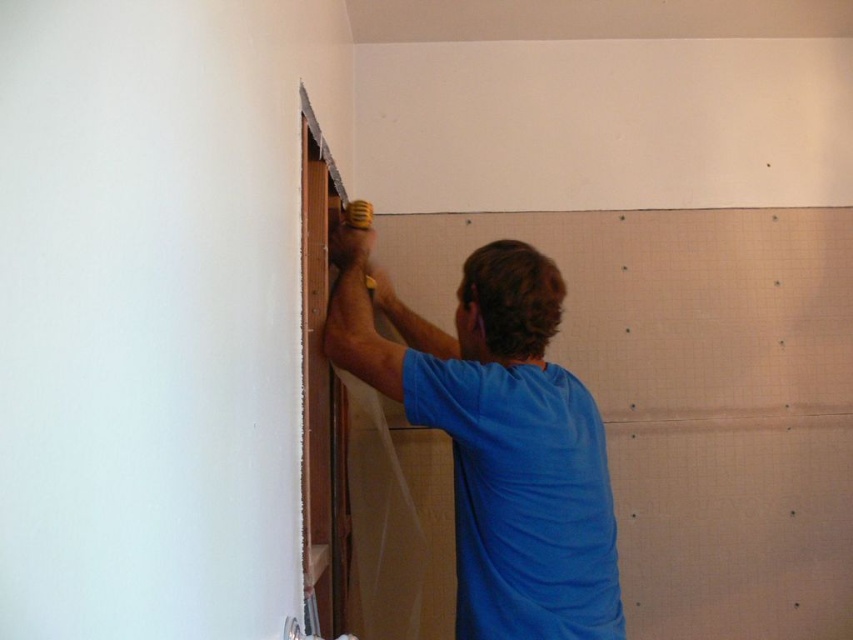
You are a construction worker who needs to know which object is wider between the blue fabric shirt at center and the yellow rubber drill at upper center. Can you tell me which one is wider?

The blue fabric shirt at center is wider than the yellow rubber drill at upper center according to the description.

You are a safety inspector checking the workspace. You notice the blue fabric shirt at center and the yellow rubber drill at upper center. According to safety protocols, which object should be kept away from the drill area to prevent accidents?

The blue fabric shirt at center should be kept away from the drill area because it is in front of the yellow rubber drill at upper center, increasing the risk of entanglement or accidental contact.

You are a construction worker in the room. You need to locate your blue fabric shirt at center. Where is it located in the room?

The blue fabric shirt at center is located at point (497, 436) in the room.